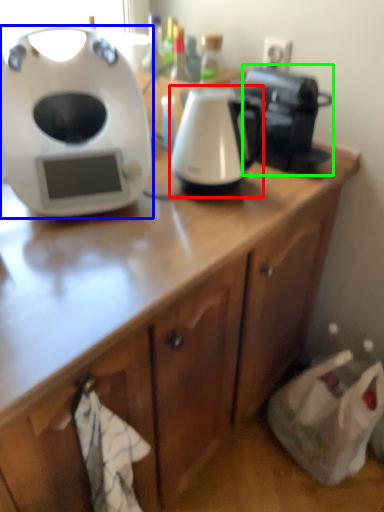
Question: Which object is positioned closest to kitchen appliance (highlighted by a red box)? Select from home appliance (highlighted by a blue box) and coffee maker (highlighted by a green box).

Choices:
 (A) home appliance
 (B) coffee maker

Answer: (B)